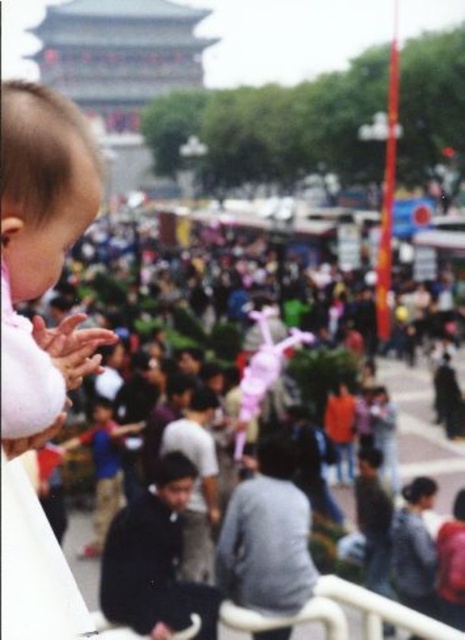
Which is more to the left, matte pink toy at center or purple fabric toy at center?

From the viewer's perspective, matte pink toy at center appears more on the left side.

Which is behind, point (349, 285) or point (256, 387)?

Positioned behind is point (349, 285).

Is point (132, 323) positioned behind point (251, 413)?

Yes.

This screenshot has width=465, height=640. In order to click on matte pink toy at center in this screenshot , I will do `click(211, 288)`.

Which is in front, point (298, 323) or point (84, 356)?

Positioned in front is point (84, 356).

Can you confirm if matte pink toy at center is thinner than white matte hand at lower left?

In fact, matte pink toy at center might be wider than white matte hand at lower left.

Identify the location of matte pink toy at center. (211, 288).

Between matte pink toy at center and soft pink fabric at left, which one appears on the left side from the viewer's perspective?

From the viewer's perspective, soft pink fabric at left appears more on the left side.

Between point (216, 276) and point (38, 285), which one is positioned behind?

The point (216, 276) is behind.

Is point (317, 390) closer to viewer compared to point (48, 332)?

No.

Identify the location of matte pink toy at center. (211, 288).